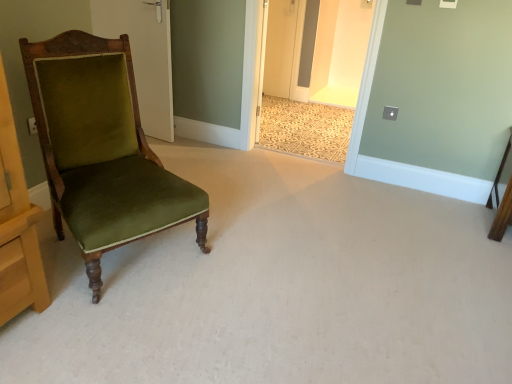
The width and height of the screenshot is (512, 384). In order to click on vacant space in front of velvet green chair at left in this screenshot , I will do `click(116, 325)`.